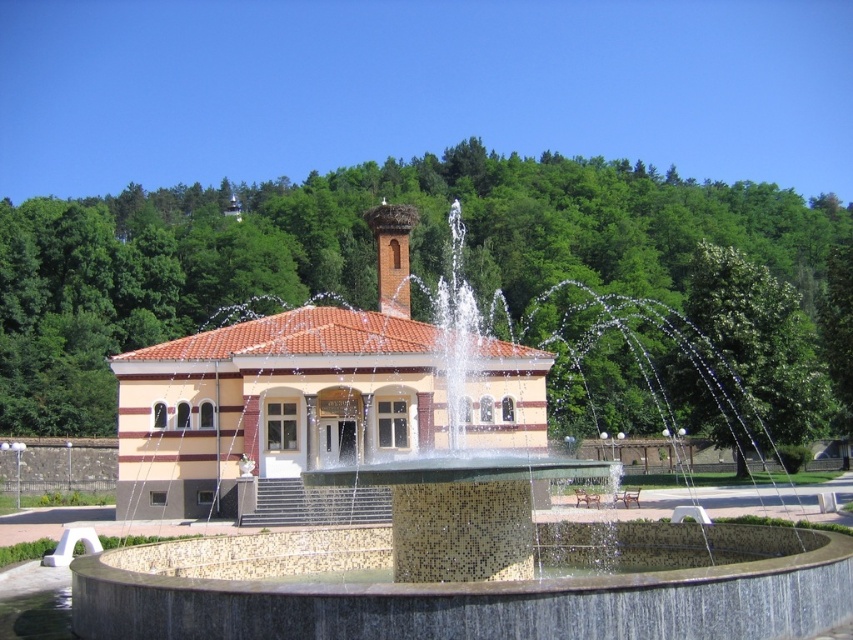
You are standing in front of the building with the fountain. There are two points marked in the scene. One is at coordinate point(279, 436) and the other is at point(192, 349). Which point is closer to you?

Point(279, 436) is closer to the viewer than point(192, 349).

You are planning to place a new bench in the scene. The bench requires a space wider than the mosaic tiled fountain at center. Can the yellow brick building at center provide enough width for the bench?

The mosaic tiled fountain at center is narrower than the yellow brick building at center. Therefore, the yellow brick building at center has sufficient width to accommodate the bench that requires more space than the fountain.

You are standing at the origin point in the image. Where is the yellow brick building at center located in terms of coordinates?

The yellow brick building at center is located at coordinates point (271, 410).